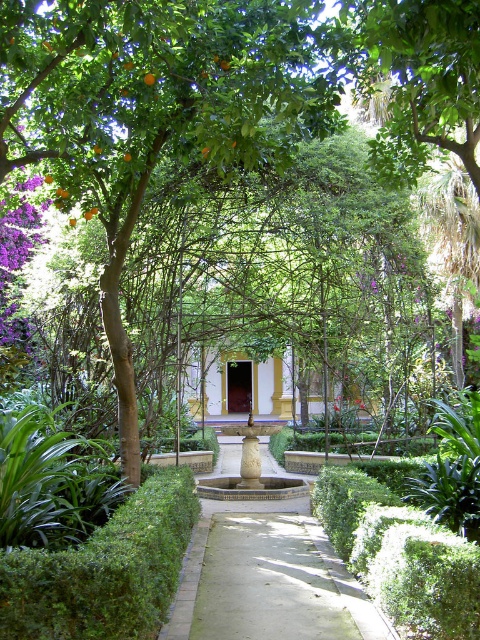
Question: Is smooth concrete path at center positioned at the back of green leafy hedge at lower left?

Choices:
 (A) no
 (B) yes

Answer: (B)

Question: Considering the relative positions of smooth concrete path at center and green leafy hedge at lower left in the image provided, where is smooth concrete path at center located with respect to green leafy hedge at lower left?

Choices:
 (A) below
 (B) above

Answer: (A)

Question: Among these objects, which one is farthest from the camera?

Choices:
 (A) smooth concrete path at center
 (B) green leafy hedge at lower left

Answer: (A)

Question: Does smooth concrete path at center appear on the right side of green leafy hedge at lower left?

Choices:
 (A) no
 (B) yes

Answer: (B)

Question: Which object is closer to the camera taking this photo?

Choices:
 (A) smooth concrete path at center
 (B) green leafy hedge at lower left

Answer: (B)